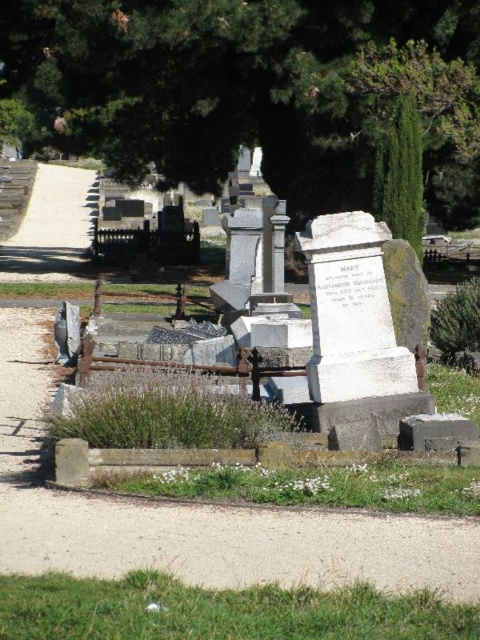
You are standing in the cemetery and want to take a photo of the white marble monument at center. To avoid having the green leafy tree at upper center block the view, where should you position yourself relative to the monument?

You should position yourself behind the white marble monument at center so that the monument is between you and the green leafy tree at upper center. Since the white marble monument at center is taller than the green leafy tree at upper center, it will block the tree from your view.

You are standing at the entrance of the cemetery and see the green leafy tree at upper center and the white marble monument at center. Which object is closer to you?

The green leafy tree at upper center is closer to you because it is further to the viewer than the white marble monument at center.